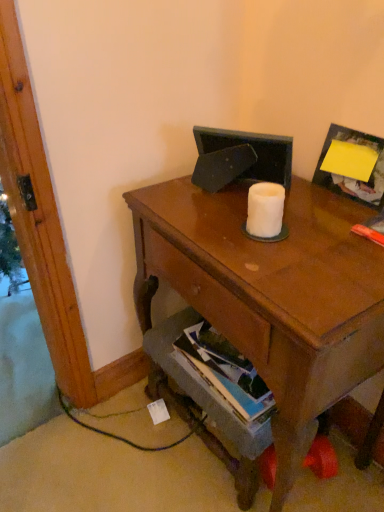
Locate an element on the screen. This screenshot has height=512, width=384. vacant space positioned to the left of matte brown desk at center is located at coordinates (109, 455).